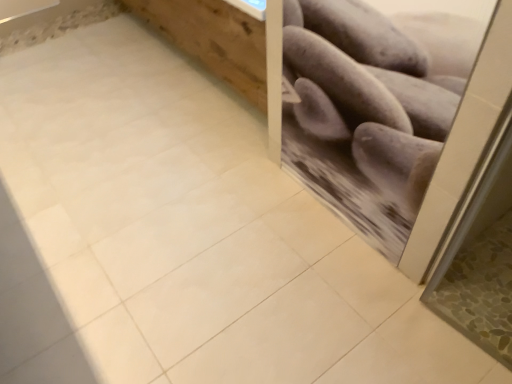
Find the location of a particular element. The height and width of the screenshot is (384, 512). vacant region in front of gray matte potatoes at upper right is located at coordinates (346, 291).